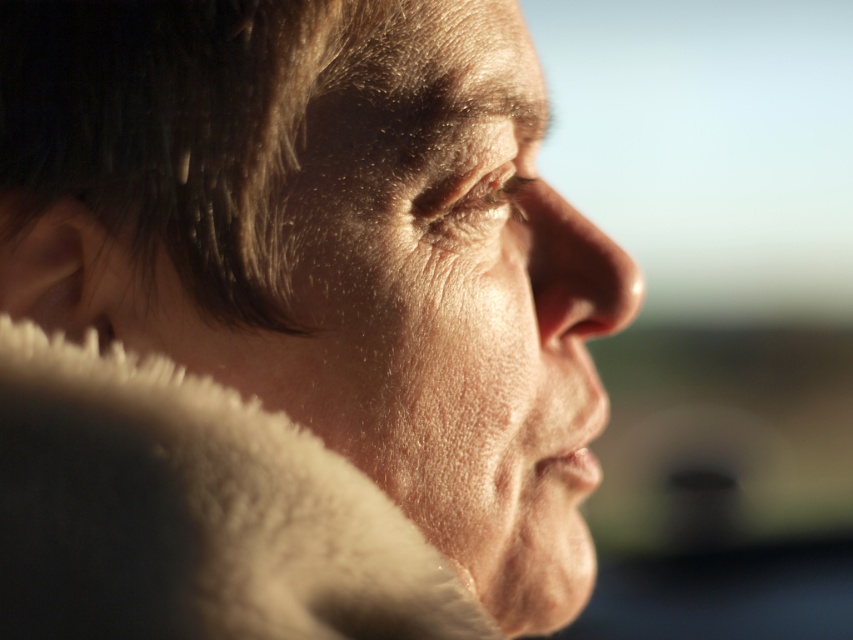
You are a photographer adjusting the focus on your camera. You notice the white fluffy fur coat at lower left and the smooth skin nose at center. Which object is wider?

The white fluffy fur coat at lower left is wider than the smooth skin nose at center.

You are a photographer adjusting your camera settings to focus on the subject. You notice the white fluffy fur coat at lower left and the smooth skin nose at center. Which object is positioned lower in the image?

The white fluffy fur coat at lower left is located below the smooth skin nose at center, so it is positioned lower in the image.

You are a photographer adjusting your camera settings to focus on the subject. You notice the white fluffy fur coat at lower left and the smooth skin nose at center. Which object is positioned to the left of the other?

The white fluffy fur coat at lower left is to the left of smooth skin nose at center.